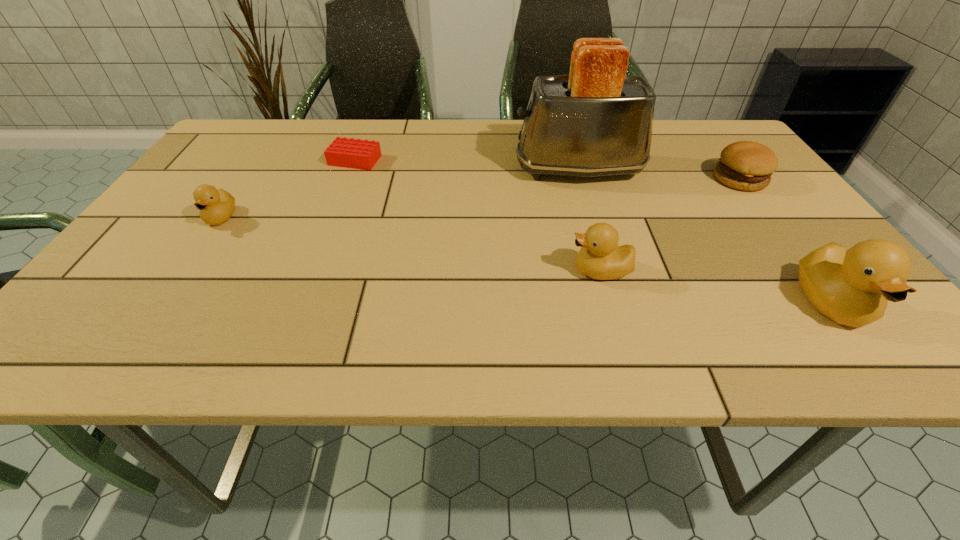
Where is `the farthest duckling`? This screenshot has width=960, height=540. the farthest duckling is located at coordinates (216, 206).

The image size is (960, 540). Find the location of `the leftmost object`. the leftmost object is located at coordinates (216, 206).

Locate an element on the screen. The image size is (960, 540). the second duckling from left to right is located at coordinates (600, 258).

The image size is (960, 540). Find the location of `the third tallest object`. the third tallest object is located at coordinates (600, 258).

Find the location of `the second tallest object`. the second tallest object is located at coordinates (852, 287).

Find the location of a particular element. This screenshot has width=960, height=540. the tallest duckling is located at coordinates (852, 287).

This screenshot has height=540, width=960. In order to click on toaster in this screenshot , I will do `click(597, 121)`.

Where is `hamburger`? hamburger is located at coordinates (745, 165).

I want to click on Lego, so click(x=353, y=153).

Identify the location of the fifth object from right to left. The height and width of the screenshot is (540, 960). (353, 153).